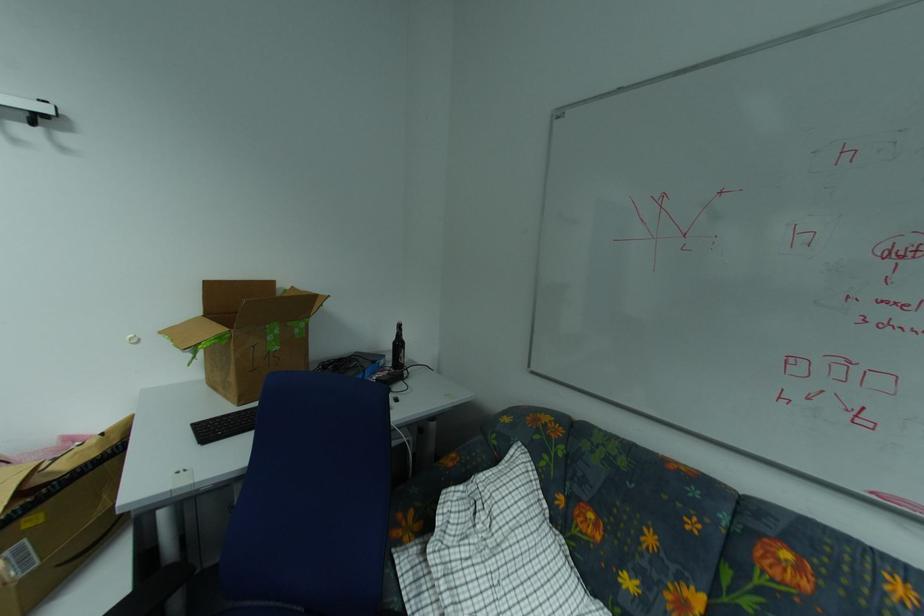
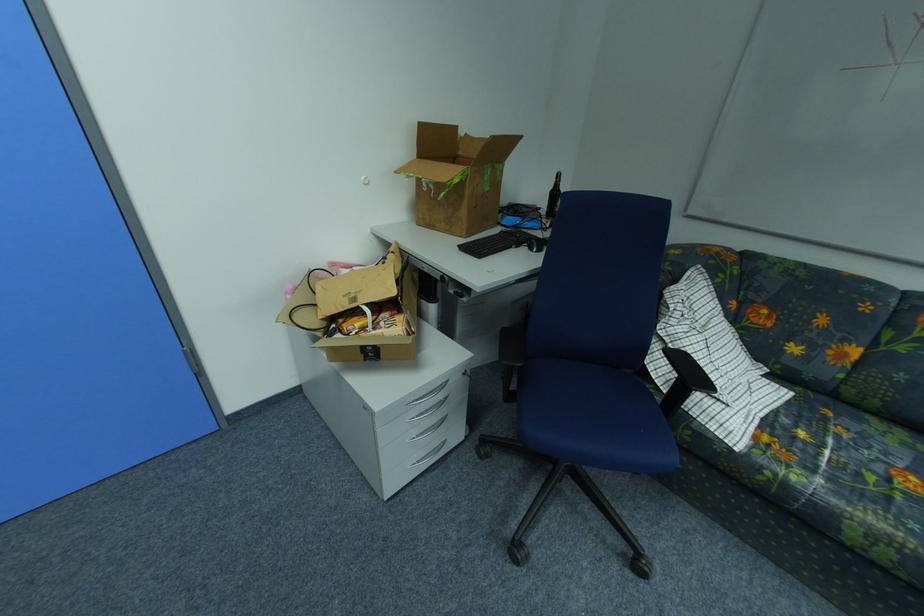
Where in the second image is the point corresponding to (x=241, y=379) from the first image?

(470, 214)